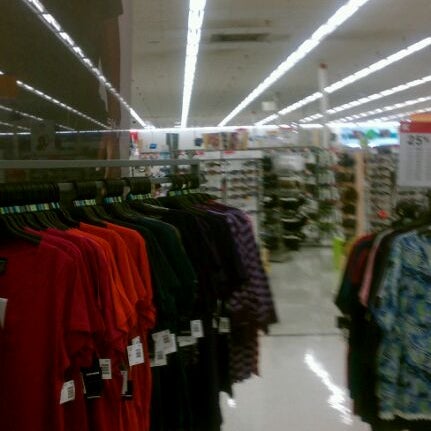
This screenshot has height=431, width=431. I want to click on glass, so click(93, 121).